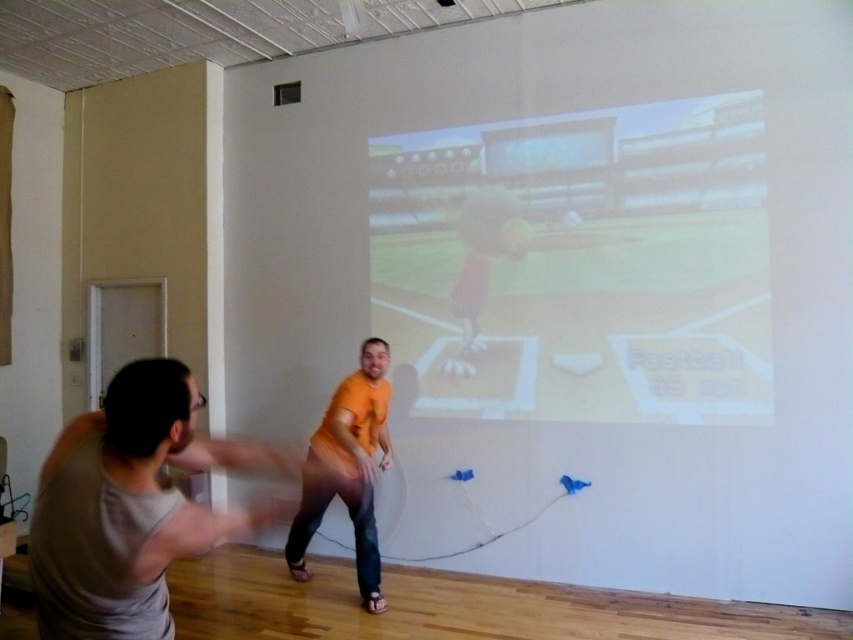
You are a delivery person who needs to place a 2 meter long package between the gray fabric shirt at left and the orange matte shirt at center. Can you fit the package between them without moving either shirt?

The distance between the gray fabric shirt at left and the orange matte shirt at center is 1.97 meters, so the 2 meter long package cannot be placed between them as it is slightly longer than the available space.

You are standing at the camera position in the room. There is a point marked at coordinates point (647,353). Can you reach that point without moving your feet?

The distance between point (647,353) and the camera is 4.08 meters. Since you are standing at the camera position, you would need to move towards the point to reach it, so you cannot reach it without moving your feet.

You are standing in the room and want to move towards the door that is slightly ajar on the left side. Is the gray fabric shirt at left blocking your path to the door?

The gray fabric shirt at left is located at point (131, 508), which is near the left side of the room. Since the door is on the left side and the shirt is positioned there, it might be blocking the path to the door. However, without knowing the exact dimensions of the room and the shirt, it is difficult to determine definitively.